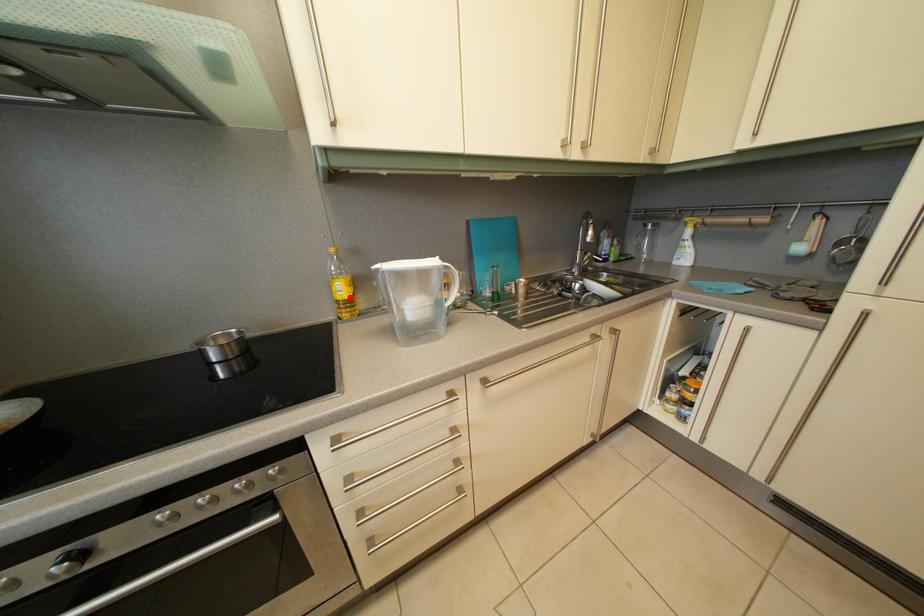
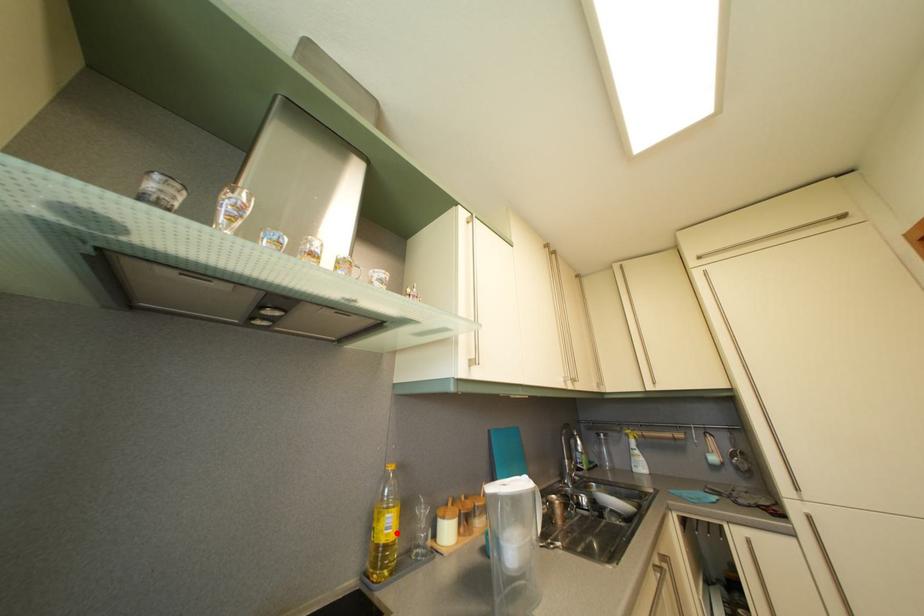
I am providing you with two images of the same scene from different viewpoints. A red point is marked on the first image and another point is marked on the second image. Does the point marked in image1 correspond to the same location as the one in image2?

Yes